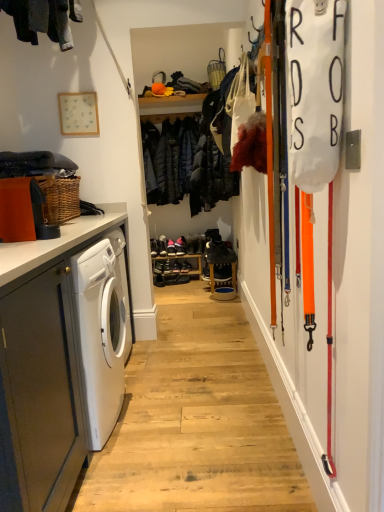
Measure the distance between dark gray fabric at left, which ranks as the first clothing in left-to-right order, and camera.

The distance of dark gray fabric at left, which ranks as the first clothing in left-to-right order, from camera is 6.80 feet.

Measure the distance between matte black basket at upper center and camera.

12.47 feet.

Measure the distance between point (221, 61) and camera.

Point (221, 61) and camera are 4.09 meters apart.

Where is `matte gray cabinet at left`? matte gray cabinet at left is located at coordinates (43, 367).

The height and width of the screenshot is (512, 384). In order to click on dark gray fabric at left, the first clothing positioned from the front in this screenshot , I will do `click(35, 164)`.

Which object is thinner, dark gray fabric at left, which ranks as the first clothing in left-to-right order, or matte black basket at upper center?

With smaller width is matte black basket at upper center.

Is dark gray fabric at left, which is the 2th clothing in back-to-front order, to the right of matte black basket at upper center from the viewer's perspective?

In fact, dark gray fabric at left, which is the 2th clothing in back-to-front order, is to the left of matte black basket at upper center.

From a real-world perspective, who is located lower, dark gray fabric at left, which is the 2th clothing in back-to-front order, or matte black basket at upper center?

In real-world perspective, dark gray fabric at left, which is the 2th clothing in back-to-front order, is lower.

Image resolution: width=384 pixels, height=512 pixels. Identify the location of the 1st clothing to the left of the matte black basket at upper center, starting your count from the anchor. (169, 158).

Which is more to the left, dark blue quilted jacket at center, marked as the first clothing in a right-to-left arrangement, or matte black basket at upper center?

dark blue quilted jacket at center, marked as the first clothing in a right-to-left arrangement, is more to the left.

Considering the positions of objects dark blue quilted jacket at center, the first clothing positioned from the back, and matte black basket at upper center in the image provided, who is in front, dark blue quilted jacket at center, the first clothing positioned from the back, or matte black basket at upper center?

matte black basket at upper center.

From a real-world perspective, is dark blue quilted jacket at center, positioned as the second clothing in front-to-back order, located beneath matte black basket at upper center?

Yes, from a real-world perspective, dark blue quilted jacket at center, positioned as the second clothing in front-to-back order, is below matte black basket at upper center.

Is dark gray fabric at left, which ranks as the first clothing in left-to-right order, wider than dark blue quilted jacket at center, marked as the first clothing in a right-to-left arrangement?

Indeed, dark gray fabric at left, which ranks as the first clothing in left-to-right order, has a greater width compared to dark blue quilted jacket at center, marked as the first clothing in a right-to-left arrangement.

In the scene shown: Considering the positions of objects dark gray fabric at left, which ranks as the first clothing in left-to-right order, and dark blue quilted jacket at center, positioned as the second clothing in front-to-back order, in the image provided, who is more to the left, dark gray fabric at left, which ranks as the first clothing in left-to-right order, or dark blue quilted jacket at center, positioned as the second clothing in front-to-back order,?

dark gray fabric at left, which ranks as the first clothing in left-to-right order.

Considering the sizes of dark gray fabric at left, which is the 2th clothing in back-to-front order, and dark blue quilted jacket at center, marked as the second clothing in a left-to-right arrangement, in the image, is dark gray fabric at left, which is the 2th clothing in back-to-front order, taller or shorter than dark blue quilted jacket at center, marked as the second clothing in a left-to-right arrangement,?

In the image, dark gray fabric at left, which is the 2th clothing in back-to-front order, appears to be shorter than dark blue quilted jacket at center, marked as the second clothing in a left-to-right arrangement.

From the image's perspective, which is below, dark gray fabric at left, which is the 2th clothing in back-to-front order, or dark blue quilted jacket at center, the first clothing positioned from the back?

dark gray fabric at left, which is the 2th clothing in back-to-front order, from the image's perspective.

Considering the sizes of objects dark blue quilted jacket at center, positioned as the second clothing in front-to-back order, and dark gray fabric at left, acting as the second clothing starting from the right, in the image provided, who is shorter, dark blue quilted jacket at center, positioned as the second clothing in front-to-back order, or dark gray fabric at left, acting as the second clothing starting from the right,?

With less height is dark gray fabric at left, acting as the second clothing starting from the right.

Does point (145, 141) appear closer or farther from the camera than point (58, 170)?

Point (145, 141) appears to be farther away from the viewer than point (58, 170).

From a real-world perspective, which object stands above the other?

dark gray fabric at left, which is the 2th clothing in back-to-front order, from a real-world perspective.

Measure the distance between dark blue quilted jacket at center, positioned as the second clothing in front-to-back order, and dark gray fabric at left, the first clothing positioned from the front.

dark blue quilted jacket at center, positioned as the second clothing in front-to-back order, is 6.45 feet from dark gray fabric at left, the first clothing positioned from the front.

Is matte black basket at upper center not within dark blue quilted jacket at center, the first clothing positioned from the back?

Yes, matte black basket at upper center is outside of dark blue quilted jacket at center, the first clothing positioned from the back.

Is matte black basket at upper center smaller than dark blue quilted jacket at center, positioned as the second clothing in front-to-back order?

Yes.

Is point (218, 71) more distant than point (185, 139)?

No, (218, 71) is in front of (185, 139).

From the image's perspective, is matte black basket at upper center located above or below matte gray cabinet at left?

matte black basket at upper center is situated higher than matte gray cabinet at left in the image.

Are matte black basket at upper center and matte gray cabinet at left making contact?

No, matte black basket at upper center is not next to matte gray cabinet at left.

Does point (220, 76) appear closer or farther from the camera than point (64, 373)?

Point (220, 76) appears to be farther away from the viewer than point (64, 373).

From a real-world perspective, is matte black basket at upper center positioned above or below matte gray cabinet at left?

matte black basket at upper center is above matte gray cabinet at left.

Which is correct: dark gray fabric at left, which is the 2th clothing in back-to-front order, is inside matte gray cabinet at left, or outside of it?

dark gray fabric at left, which is the 2th clothing in back-to-front order, is located beyond the bounds of matte gray cabinet at left.

From the image's perspective, between dark gray fabric at left, acting as the second clothing starting from the right, and matte gray cabinet at left, who is located below?

matte gray cabinet at left.

Is dark gray fabric at left, acting as the second clothing starting from the right, in contact with matte gray cabinet at left?

No, dark gray fabric at left, acting as the second clothing starting from the right, is not next to matte gray cabinet at left.

At what (x,y) coordinates should I click in order to perform the action: click on basket behind the dark gray fabric at left, acting as the second clothing starting from the right. Please return your answer as a coordinate pair (x, y). Looking at the image, I should click on (216, 70).

From the image's perspective, starting from the matte black basket at upper center, which clothing is the 1st one below? Please provide its 2D coordinates.

[(169, 158)]

Looking at the image, which one is located further to matte gray cabinet at left, dark gray fabric at left, acting as the second clothing starting from the right, or matte black basket at upper center?

The object further to matte gray cabinet at left is matte black basket at upper center.

Considering their positions, is matte gray cabinet at left positioned closer to matte black basket at upper center than dark blue quilted jacket at center, the first clothing positioned from the back?

Among the two, dark blue quilted jacket at center, the first clothing positioned from the back, is located nearer to matte black basket at upper center.

Estimate the real-world distances between objects in this image. Which object is further from dark gray fabric at left, acting as the second clothing starting from the right, dark blue quilted jacket at center, positioned as the second clothing in front-to-back order, or matte gray cabinet at left?

dark blue quilted jacket at center, positioned as the second clothing in front-to-back order, is positioned further to the anchor dark gray fabric at left, acting as the second clothing starting from the right.

Which object lies nearer to the anchor point matte black basket at upper center, dark gray fabric at left, which is the 2th clothing in back-to-front order, or dark blue quilted jacket at center, marked as the second clothing in a left-to-right arrangement?

The object closer to matte black basket at upper center is dark blue quilted jacket at center, marked as the second clothing in a left-to-right arrangement.

When comparing their distances from matte gray cabinet at left, does matte black basket at upper center or dark gray fabric at left, acting as the second clothing starting from the right, seem further?

Based on the image, matte black basket at upper center appears to be further to matte gray cabinet at left.

In the scene shown: Estimate the real-world distances between objects in this image. Which object is closer to dark gray fabric at left, acting as the second clothing starting from the right, matte black basket at upper center or matte gray cabinet at left?

matte gray cabinet at left lies closer to dark gray fabric at left, acting as the second clothing starting from the right, than the other object.

Considering their positions, is matte gray cabinet at left positioned closer to dark blue quilted jacket at center, the first clothing positioned from the back, than dark gray fabric at left, acting as the second clothing starting from the right?

The object closer to dark blue quilted jacket at center, the first clothing positioned from the back, is dark gray fabric at left, acting as the second clothing starting from the right.

Estimate the real-world distances between objects in this image. Which object is closer to dark gray fabric at left, the first clothing positioned from the front, matte black basket at upper center or dark blue quilted jacket at center, positioned as the second clothing in front-to-back order?

dark blue quilted jacket at center, positioned as the second clothing in front-to-back order, is positioned closer to the anchor dark gray fabric at left, the first clothing positioned from the front.

You are a GUI agent. You are given a task and a screenshot of the screen. Output one action in this format:
    pyautogui.click(x=<x>, y=<y>)
    Task: Click on the clothing between matte gray cabinet at left and dark blue quilted jacket at center, marked as the first clothing in a right-to-left arrangement, in the front-back direction
    
    Given the screenshot: What is the action you would take?
    pyautogui.click(x=35, y=164)

This screenshot has height=512, width=384. Identify the location of clothing between matte gray cabinet at left and matte black basket at upper center along the z-axis. (35, 164).

Identify the location of basket between matte gray cabinet at left and dark blue quilted jacket at center, marked as the first clothing in a right-to-left arrangement, in the front-back direction. The image size is (384, 512). (216, 70).

The image size is (384, 512). I want to click on basket located between dark gray fabric at left, which ranks as the first clothing in left-to-right order, and dark blue quilted jacket at center, marked as the first clothing in a right-to-left arrangement, in the depth direction, so click(x=216, y=70).